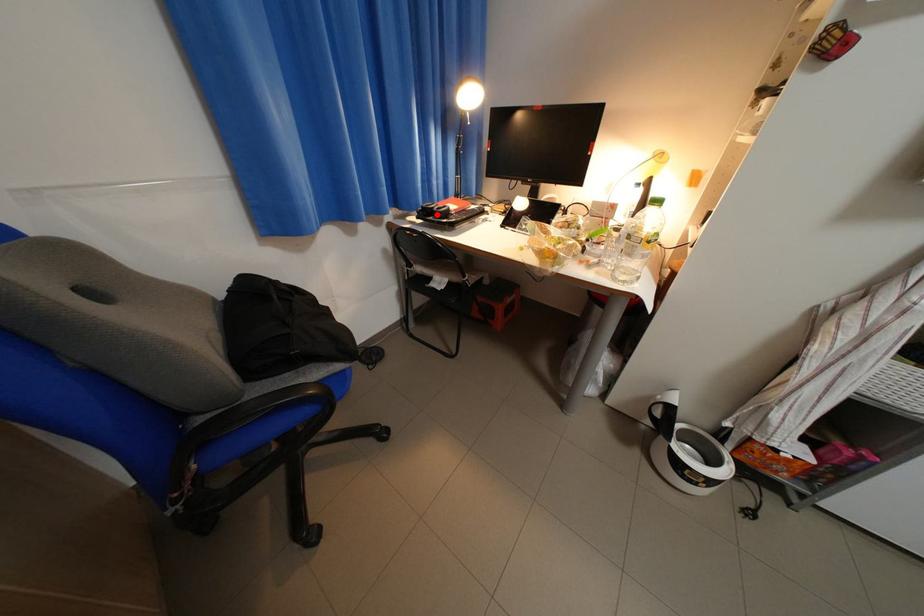
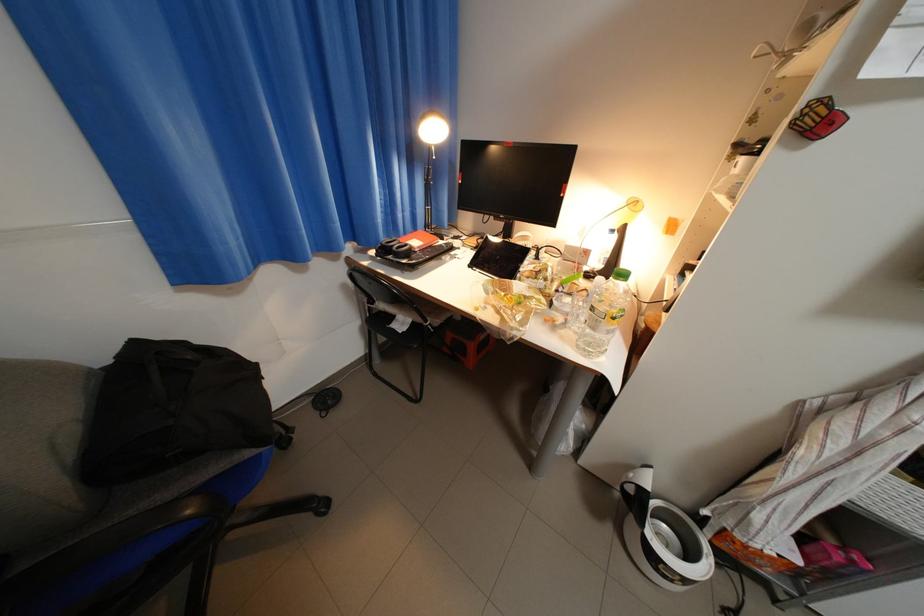
The point at the highlighted location is marked in the first image. Where is the corresponding point in the second image?

(395, 253)